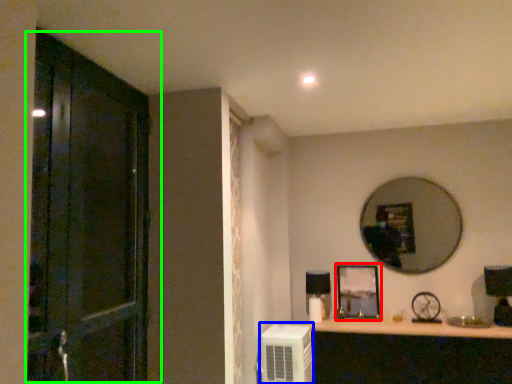
Question: Which object is the closest to the picture frame (highlighted by a red box)? Choose among these: air conditioner (highlighted by a blue box) or door (highlighted by a green box).

Choices:
 (A) air conditioner
 (B) door

Answer: (A)